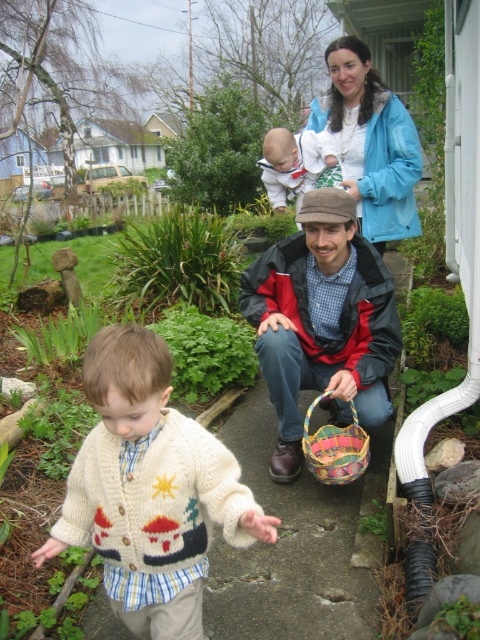
Question: Does knitted sweater at center have a larger size compared to blue fabric jacket at upper center?

Choices:
 (A) no
 (B) yes

Answer: (A)

Question: Can you confirm if blue fabric jacket at upper center is thinner than white fleece jacket at upper center?

Choices:
 (A) no
 (B) yes

Answer: (A)

Question: Does blue fabric jacket at upper center appear over white fleece jacket at upper center?

Choices:
 (A) yes
 (B) no

Answer: (A)

Question: Which object is the farthest from the blue fabric jacket at upper center?

Choices:
 (A) white fleece jacket at upper center
 (B) red and black jacket at center

Answer: (B)

Question: Considering the real-world distances, which object is farthest from the white fleece jacket at upper center?

Choices:
 (A) red and black jacket at center
 (B) multicolored woven basket at lower center

Answer: (B)

Question: Which of the following is the closest to the observer?

Choices:
 (A) (365, 445)
 (B) (186, 538)
 (C) (330, 45)

Answer: (B)